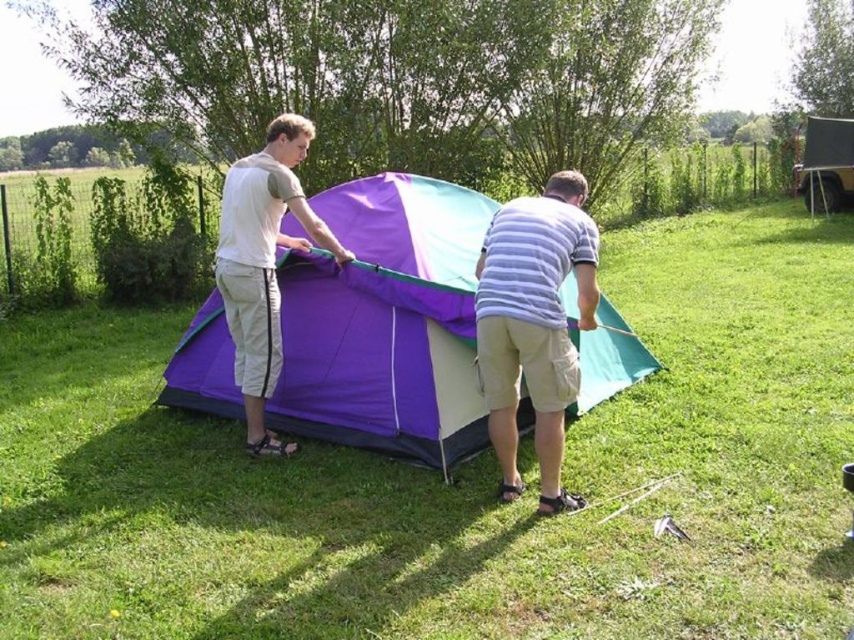
Question: Does striped cotton shirt at center have a larger size compared to matte white t-shirt at left?

Choices:
 (A) no
 (B) yes

Answer: (A)

Question: Which object is farther from the camera taking this photo?

Choices:
 (A) black canvas tent at right
 (B) striped cotton shirt at center

Answer: (A)

Question: Estimate the real-world distances between objects in this image. Which object is closer to the striped cotton shirt at center?

Choices:
 (A) black canvas tent at right
 (B) purple fabric tent at center
 (C) matte white t-shirt at left

Answer: (B)

Question: Is striped cotton shirt at center smaller than black canvas tent at right?

Choices:
 (A) no
 (B) yes

Answer: (B)

Question: Which object is farther from the camera taking this photo?

Choices:
 (A) purple fabric tent at center
 (B) striped cotton shirt at center
 (C) matte white t-shirt at left

Answer: (C)

Question: Where is striped cotton shirt at center located in relation to black canvas tent at right in the image?

Choices:
 (A) above
 (B) below

Answer: (B)